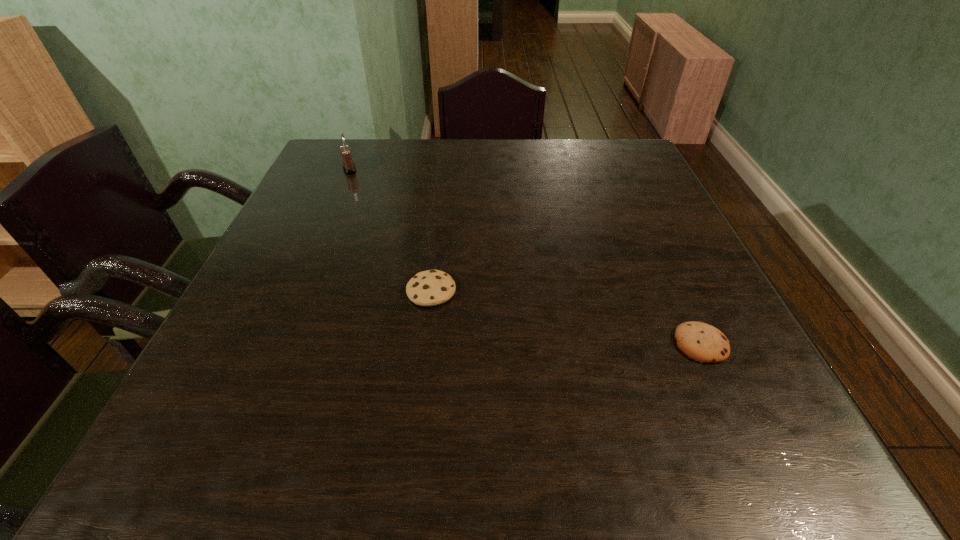
The width and height of the screenshot is (960, 540). I want to click on padlock, so click(349, 167).

Locate an element on the screen. the farthest object is located at coordinates (349, 167).

Find the location of a particular element. This screenshot has height=540, width=960. the second shortest object is located at coordinates (433, 287).

Identify the location of the second nearest object. The height and width of the screenshot is (540, 960). (433, 287).

The image size is (960, 540). I want to click on the shortest object, so click(x=702, y=342).

The image size is (960, 540). I want to click on the shorter cookie, so click(702, 342).

Where is `free region located on the front of the leftmost object`? This screenshot has width=960, height=540. free region located on the front of the leftmost object is located at coordinates (339, 195).

Locate an element on the screen. Image resolution: width=960 pixels, height=540 pixels. free space located on the front of the farther cookie is located at coordinates (417, 417).

This screenshot has width=960, height=540. Identify the location of vacant space located 0.120m on the back of the right cookie. point(671,280).

Find the location of `object positioned at the far edge`. object positioned at the far edge is located at coordinates (349, 167).